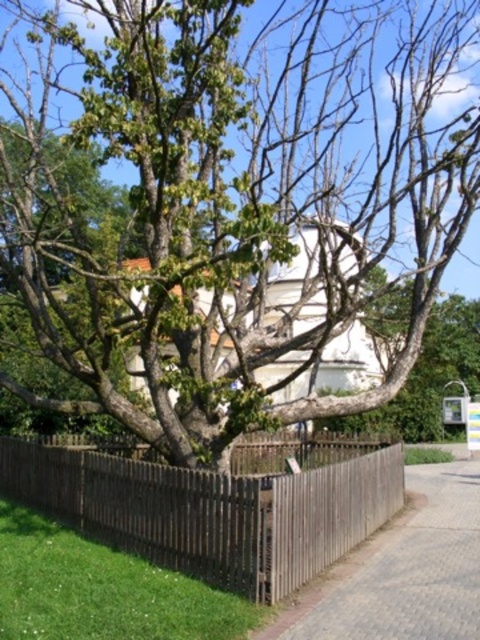
You are standing in a garden and see the green leafy tree at center and the brown wooden fence at lower center. Which object is higher from the ground?

The green leafy tree at center is located above the brown wooden fence at lower center, so it is higher from the ground.

Looking at this image, you are standing in a park and see the green leafy tree at center and the brown wooden fence at lower center. Which object takes up more space in the image?

The green leafy tree at center takes up more space in the image because it is bigger than the brown wooden fence at lower center.

Based on the photo, you are standing in a park and see a large tree with a thick trunk and sprawling branches. There is a point marked at coordinates (237,204). What does this point indicate?

The point at (237,204) indicates the location of the green leafy tree at center.